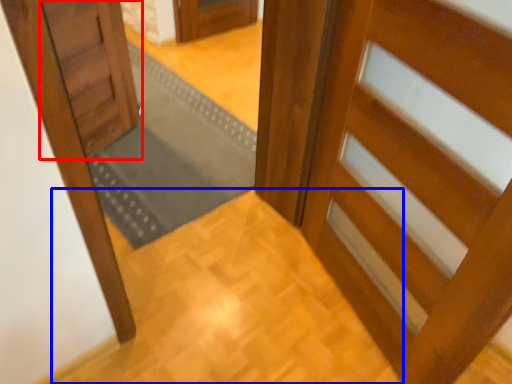
Question: Which of the following is the farthest to the observer, door (highlighted by a red box) or path (highlighted by a blue box)?

Choices:
 (A) door
 (B) path

Answer: (A)